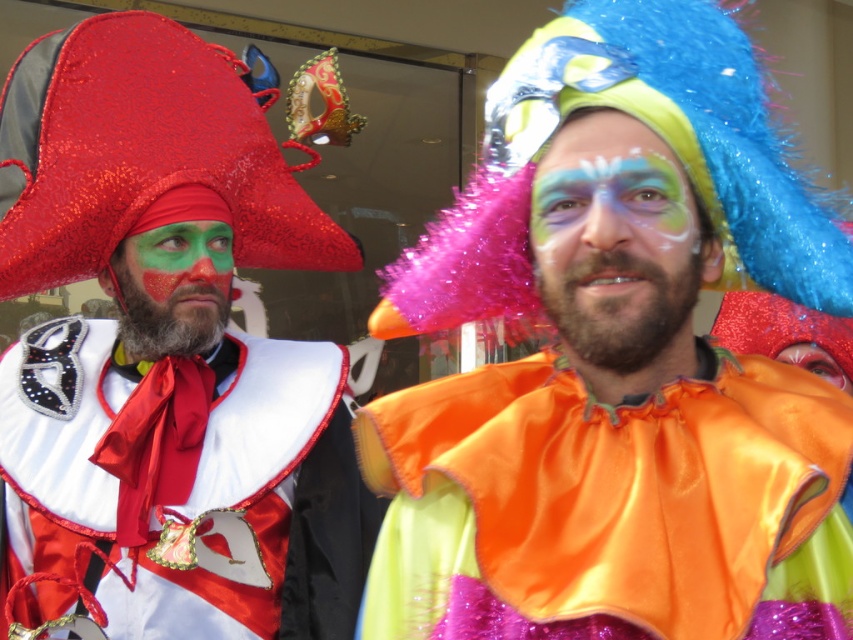
Does orange satin clown costume at center have a smaller size compared to orange satin shirt at center?

Actually, orange satin clown costume at center might be larger than orange satin shirt at center.

The height and width of the screenshot is (640, 853). I want to click on orange satin clown costume at center, so click(x=616, y=360).

Locate an element on the screen. Image resolution: width=853 pixels, height=640 pixels. orange satin clown costume at center is located at coordinates (616, 360).

Does orange satin clown costume at center come behind green matte face paint at center?

No, orange satin clown costume at center is in front of green matte face paint at center.

Is orange satin clown costume at center taller than green matte face paint at center?

Yes.

Describe the element at coordinates (616, 360) in the screenshot. I see `orange satin clown costume at center` at that location.

This screenshot has height=640, width=853. What are the coordinates of `orange satin clown costume at center` in the screenshot? It's located at (616, 360).

From the picture: Is orange satin shirt at center below green matte face paint at center?

Yes, orange satin shirt at center is below green matte face paint at center.

Who is taller, orange satin shirt at center or green matte face paint at center?

orange satin shirt at center

Who is more distant from viewer, [358,445] or [142,240]?

Point [142,240]

Where is `orange satin shirt at center`? This screenshot has width=853, height=640. orange satin shirt at center is located at coordinates [x=611, y=506].